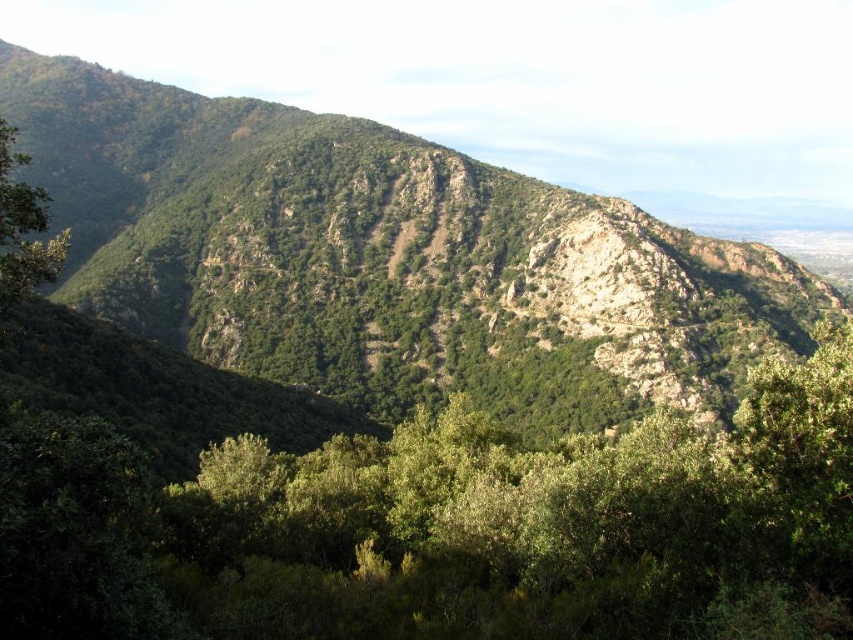
You are a hiker planning to reach the summit of the mountain. You have a map that marks a point at coordinates point (387, 259). According to the image, what terrain feature is located at this point?

The point (387, 259) is on a green rocky mountain at center, so the terrain feature at this point is a rocky mountain.

You are a hiker trying to locate a green leafy tree in the center of a mountainous area. The coordinates provided are in normalized image coordinates where the origin is at the bottom left corner. Can you confirm if the green leafy tree at center is indeed at point [445,529]?

Yes, the green leafy tree at center is located at point [445,529] according to the coordinates provided.